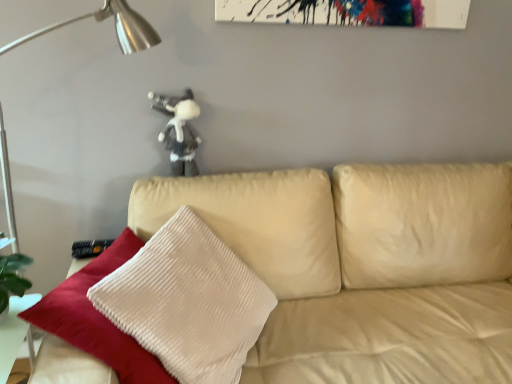
Question: Can beige leather couch at center be found inside metallic silver table lamp at left?

Choices:
 (A) no
 (B) yes

Answer: (A)

Question: Is metallic silver table lamp at left smaller than beige leather couch at center?

Choices:
 (A) yes
 (B) no

Answer: (A)

Question: Does metallic silver table lamp at left turn towards beige leather couch at center?

Choices:
 (A) no
 (B) yes

Answer: (B)

Question: Can you confirm if metallic silver table lamp at left is wider than beige leather couch at center?

Choices:
 (A) no
 (B) yes

Answer: (A)

Question: Is metallic silver table lamp at left positioned before beige leather couch at center?

Choices:
 (A) yes
 (B) no

Answer: (B)

Question: From a real-world perspective, is metallic silver table lamp at left under beige leather couch at center?

Choices:
 (A) no
 (B) yes

Answer: (A)

Question: Is white plush toy at upper center bigger than metallic silver table lamp at left?

Choices:
 (A) no
 (B) yes

Answer: (A)

Question: From a real-world perspective, is white plush toy at upper center physically below metallic silver table lamp at left?

Choices:
 (A) yes
 (B) no

Answer: (B)

Question: Is white plush toy at upper center to the right of metallic silver table lamp at left from the viewer's perspective?

Choices:
 (A) yes
 (B) no

Answer: (A)

Question: Is white plush toy at upper center oriented towards metallic silver table lamp at left?

Choices:
 (A) yes
 (B) no

Answer: (B)

Question: Is metallic silver table lamp at left located within white plush toy at upper center?

Choices:
 (A) yes
 (B) no

Answer: (B)

Question: Does white plush toy at upper center lie in front of metallic silver table lamp at left?

Choices:
 (A) no
 (B) yes

Answer: (A)

Question: Is metallic silver table lamp at left wider than white plush toy at upper center?

Choices:
 (A) yes
 (B) no

Answer: (A)